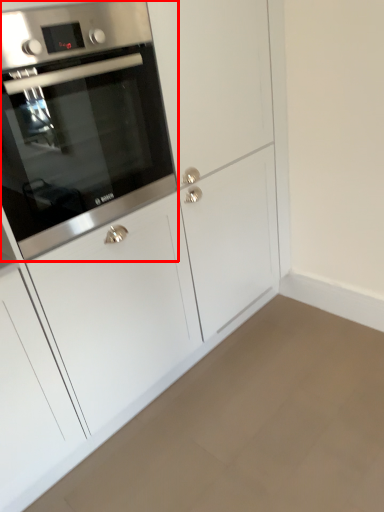
Question: From the image's perspective, where is oven (annotated by the red box) located relative to plain?

Choices:
 (A) below
 (B) above

Answer: (B)